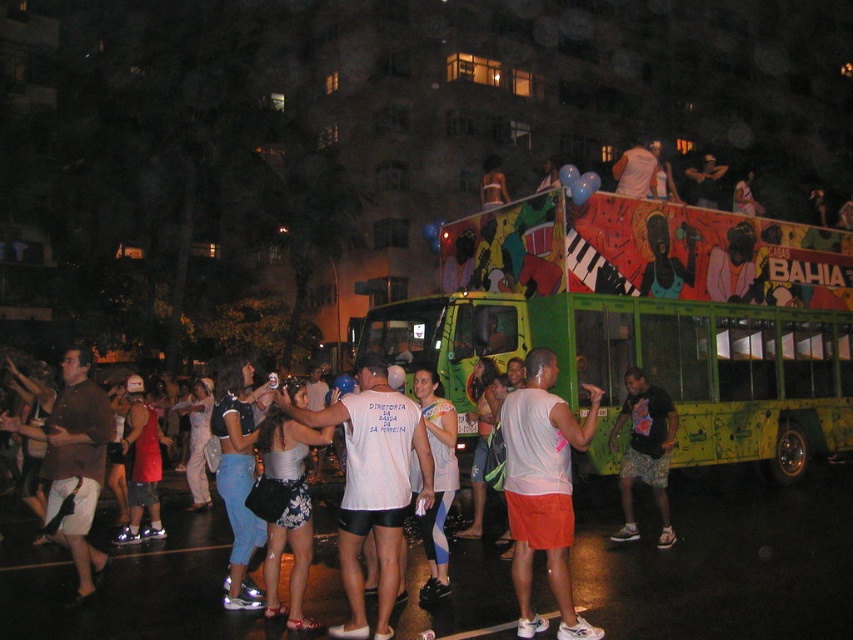
Consider the image. You are a photographer standing in the middle of the street. You want to take a photo that includes both the green painted bus at center and the brown fabric shirt at left. Which object should you focus on first to ensure both are in the frame?

You should focus on the green painted bus at center first because it is closer to you than the brown fabric shirt at left, so adjusting the frame to include it will naturally include the shirt in the background.